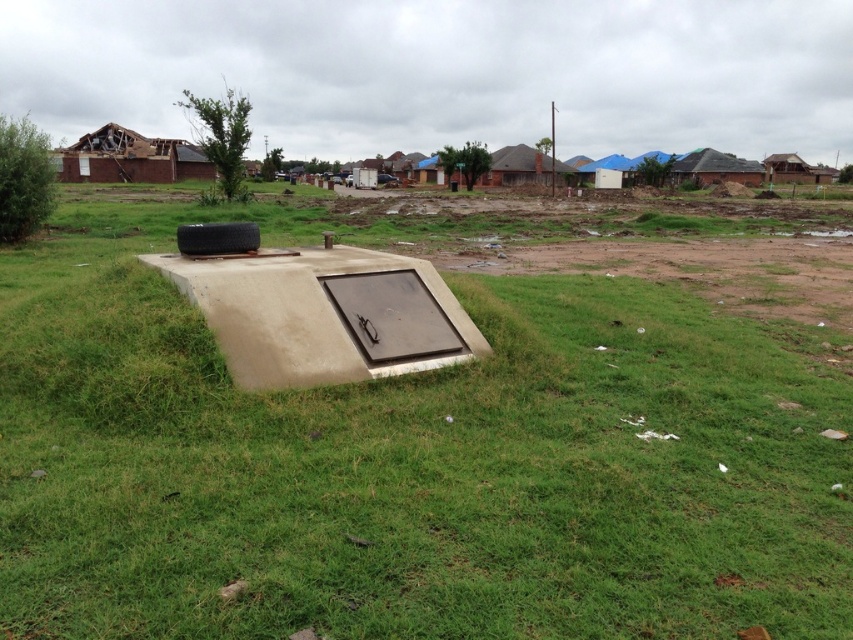
Describe the element at coordinates (410, 458) in the screenshot. This screenshot has height=640, width=853. I see `concrete at center` at that location.

Which of these two, concrete at center or brick house at upper left, stands taller?

With more height is brick house at upper left.

Who is more forward, (108,480) or (78,164)?

Point (108,480) is more forward.

Where is `concrete at center`? concrete at center is located at coordinates (410, 458).

Between concrete at center and brown corrugated roof at upper right, which one has less height?

With less height is concrete at center.

Is concrete at center bigger than brown corrugated roof at upper right?

Incorrect, concrete at center is not larger than brown corrugated roof at upper right.

The height and width of the screenshot is (640, 853). I want to click on concrete at center, so click(x=410, y=458).

Looking at this image, between brick house at upper left and brown corrugated roof at upper right, which one is positioned lower?

brick house at upper left is below.

Between point (85, 147) and point (735, 172), which one is positioned in front?

Point (85, 147) is more forward.

Which is in front, point (146, 166) or point (743, 164)?

Positioned in front is point (146, 166).

Where is `brick house at upper left`? The height and width of the screenshot is (640, 853). brick house at upper left is located at coordinates (129, 157).